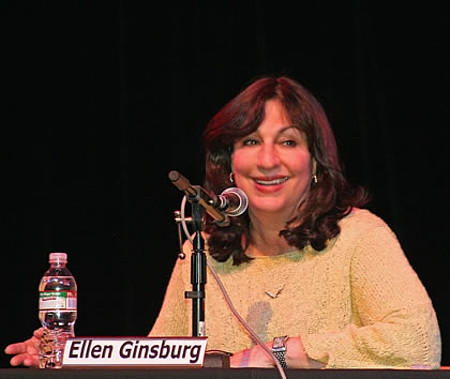
This screenshot has height=379, width=450. In order to click on blank space, black curtain in this screenshot , I will do `click(414, 162)`, `click(75, 175)`, `click(117, 36)`.